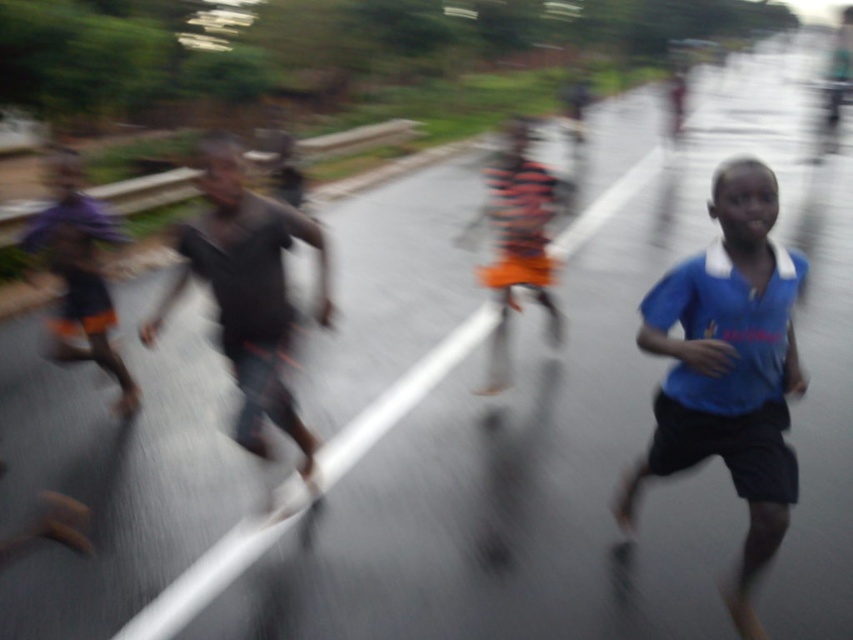
Question: From the image, what is the correct spatial relationship of blue fabric shirt at right in relation to dark gray fabric pants at left?

Choices:
 (A) left
 (B) right

Answer: (B)

Question: Which point is closer to the camera?

Choices:
 (A) dark gray fabric pants at left
 (B) blue fabric shirt at right
 (C) orange striped shirt at center

Answer: (B)

Question: Can you confirm if dark gray fabric pants at left is positioned below orange striped shirt at center?

Choices:
 (A) yes
 (B) no

Answer: (A)

Question: In this image, where is dark gray fabric pants at left located relative to orange striped shirt at center?

Choices:
 (A) below
 (B) above

Answer: (A)

Question: Which point is closer to the camera?

Choices:
 (A) blue fabric shirt at right
 (B) dark gray fabric pants at left
 (C) orange striped shirt at center

Answer: (A)

Question: Which of the following is the closest to the observer?

Choices:
 (A) (763, 634)
 (B) (318, 317)
 (C) (508, 164)

Answer: (A)